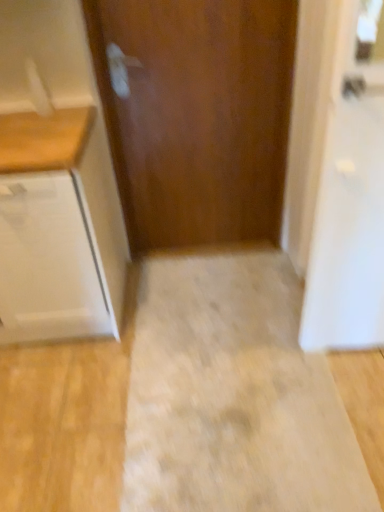
Locate an element on the screen. The height and width of the screenshot is (512, 384). wooden door at center is located at coordinates tap(197, 116).

The width and height of the screenshot is (384, 512). Describe the element at coordinates (197, 116) in the screenshot. I see `wooden door at center` at that location.

Locate an element on the screen. The height and width of the screenshot is (512, 384). wooden door at center is located at coordinates (197, 116).